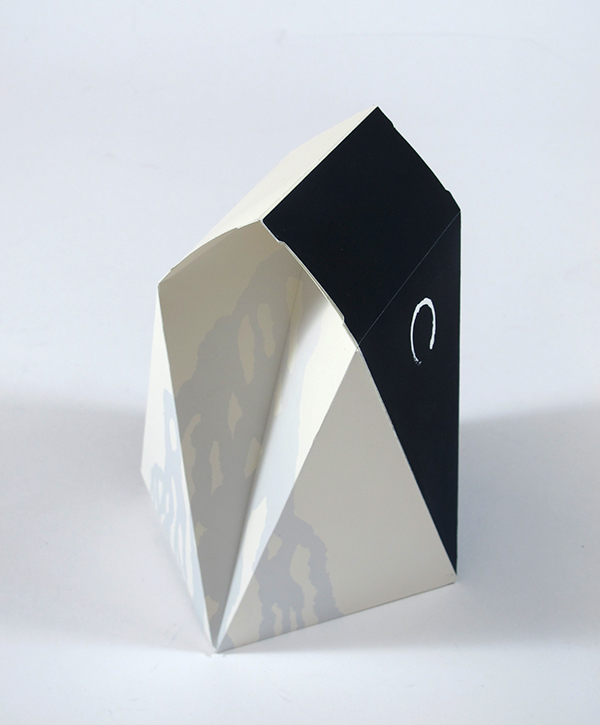
This screenshot has height=725, width=600. Find the location of `corners`. corners is located at coordinates (454, 581), (216, 645), (137, 473), (158, 281), (260, 220), (374, 107), (359, 346), (457, 209).